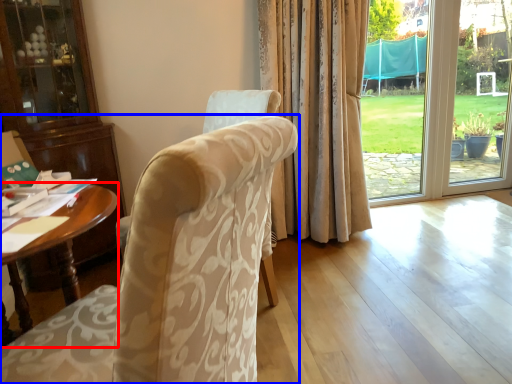
Question: Which object appears closest to the camera in this image, desk (highlighted by a red box) or chair (highlighted by a blue box)?

Choices:
 (A) desk
 (B) chair

Answer: (B)